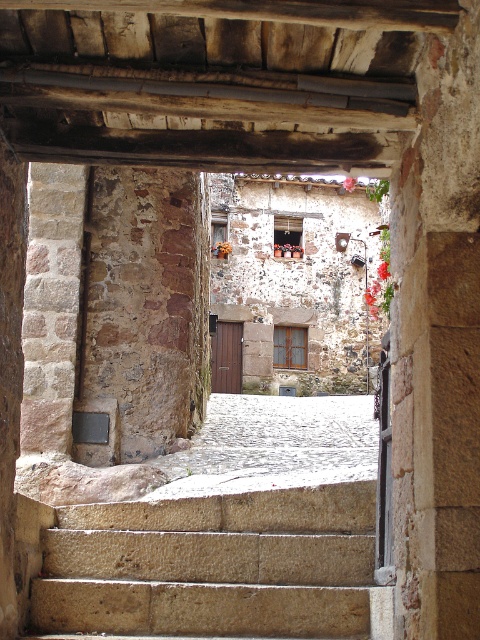
Question: Which object is farther from the camera taking this photo?

Choices:
 (A) natural stone stairs at center
 (B) rustic stone pillar at left

Answer: (B)

Question: Can you confirm if natural stone stairs at center is positioned to the right of rustic stone pillar at left?

Choices:
 (A) no
 (B) yes

Answer: (B)

Question: Which point is farther from the camera taking this photo?

Choices:
 (A) (204, 205)
 (B) (231, 563)

Answer: (A)

Question: In this image, where is natural stone stairs at center located relative to rustic stone pillar at left?

Choices:
 (A) above
 (B) below

Answer: (B)

Question: Does natural stone stairs at center appear over rustic stone pillar at left?

Choices:
 (A) no
 (B) yes

Answer: (A)